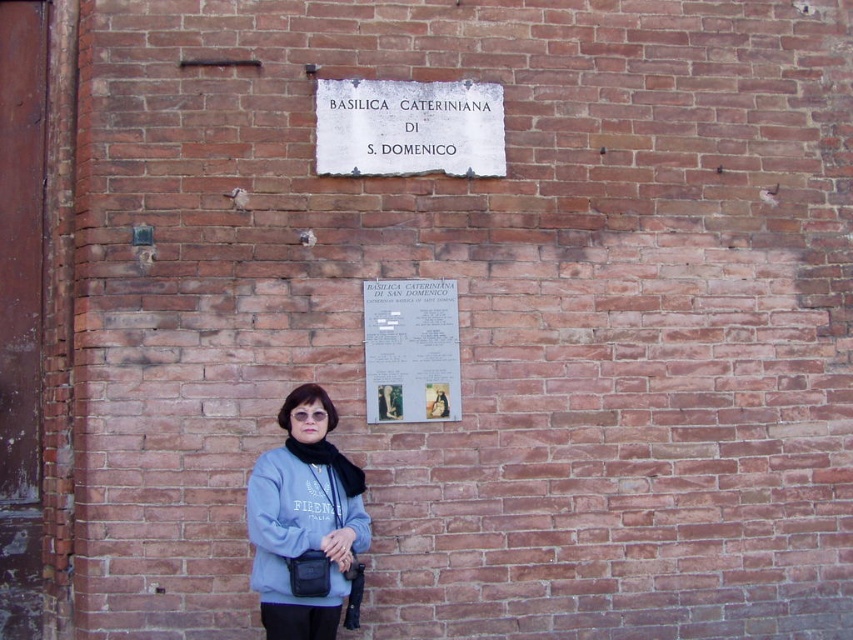
Question: Which is farther from the light blue fleece at center?

Choices:
 (A) white stone sign at upper center
 (B) white paper at upper center

Answer: (A)

Question: Which is farther from the white paper at upper center?

Choices:
 (A) white stone sign at upper center
 (B) light blue fleece at center

Answer: (A)

Question: Which point is farther from the camera taking this photo?

Choices:
 (A) (421, 120)
 (B) (270, 593)
 (C) (386, 342)

Answer: (A)

Question: Considering the relative positions of light blue fleece at center and white stone sign at upper center in the image provided, where is light blue fleece at center located with respect to white stone sign at upper center?

Choices:
 (A) above
 (B) below

Answer: (B)

Question: Can you confirm if white stone sign at upper center is positioned below white paper at upper center?

Choices:
 (A) no
 (B) yes

Answer: (A)

Question: Can you confirm if white stone sign at upper center is thinner than white paper at upper center?

Choices:
 (A) no
 (B) yes

Answer: (A)